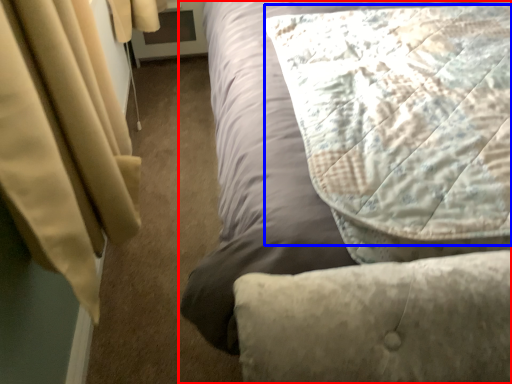
Question: Which object appears closest to the camera in this image, bed (highlighted by a red box) or pillow (highlighted by a blue box)?

Choices:
 (A) bed
 (B) pillow

Answer: (A)